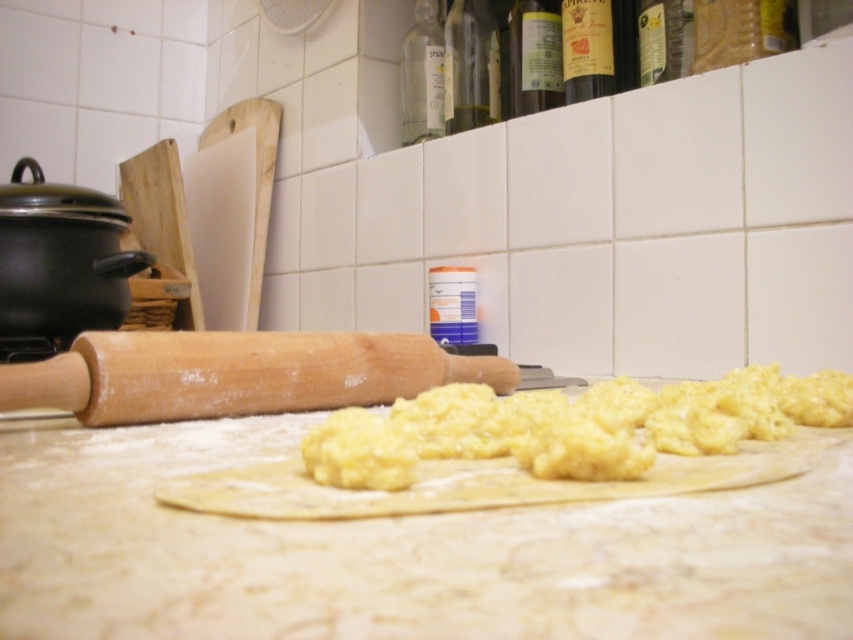
You are a chef preparing dough and see the yellow dough at center and the wooden rolling pin at center on the kitchen countertop. Which object is positioned lower on the countertop?

The yellow dough at center is located below the wooden rolling pin at center, so the yellow dough at center is positioned lower on the countertop.

Consider the image. You are a chef preparing dough and see the yellow dough at center and the wooden rolling pin at center on the countertop. Which object is positioned to the right of the other?

The yellow dough at center is to the right of wooden rolling pin at center.